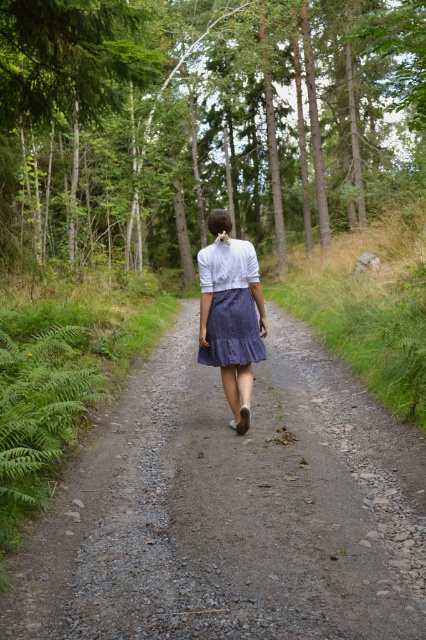
You are a hiker trying to decide whether to walk on the dirt path at center or the denim skirt at center. Which one is larger in size?

The dirt path at center is bigger than the denim skirt at center, so you should choose the dirt path at center as it is larger in size.